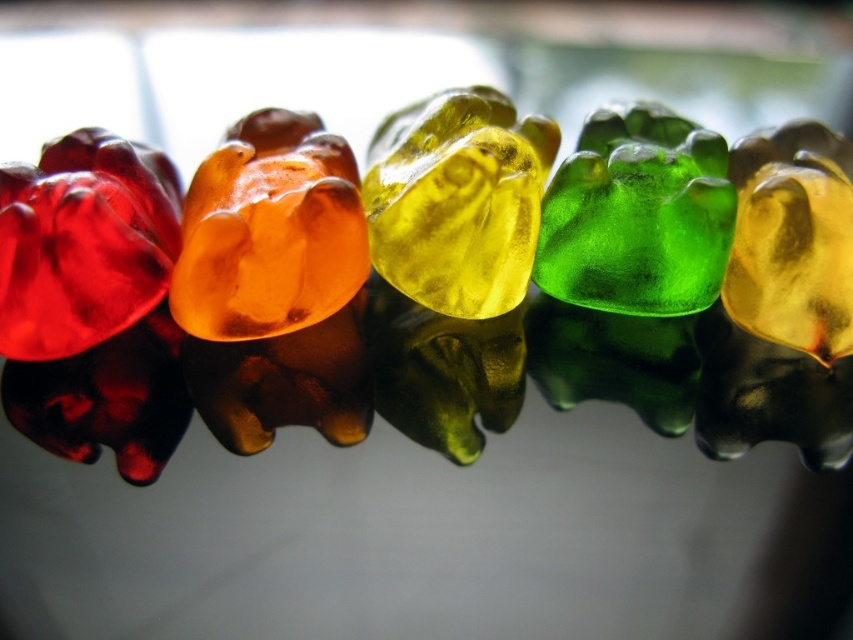
You are a child trying to pick the closest gummy bear to you from the row. Which one should you choose between the translucent yellow jelly bear at center and the green translucent gummy bear at center?

The translucent yellow jelly bear at center is closer to you than the green translucent gummy bear at center, so you should choose the translucent yellow jelly bear at center.

You are a child trying to pick the yellow gummy bear from the row. Since both the translucent yellow jelly bear at center and the green translucent gummy bear at center are in your view, which one should you pick to get the yellow one?

The translucent yellow jelly bear at center is located above the green translucent gummy bear at center, so you should pick the one above to get the yellow one.

You are a photographer trying to capture the gummy bears. You notice two points in the image at coordinates point [378,166] and point [563,184]. Which point is closer to your camera?

Point [563,184] is closer to the camera because point [378,166] is further away from the camera than point [563,184].